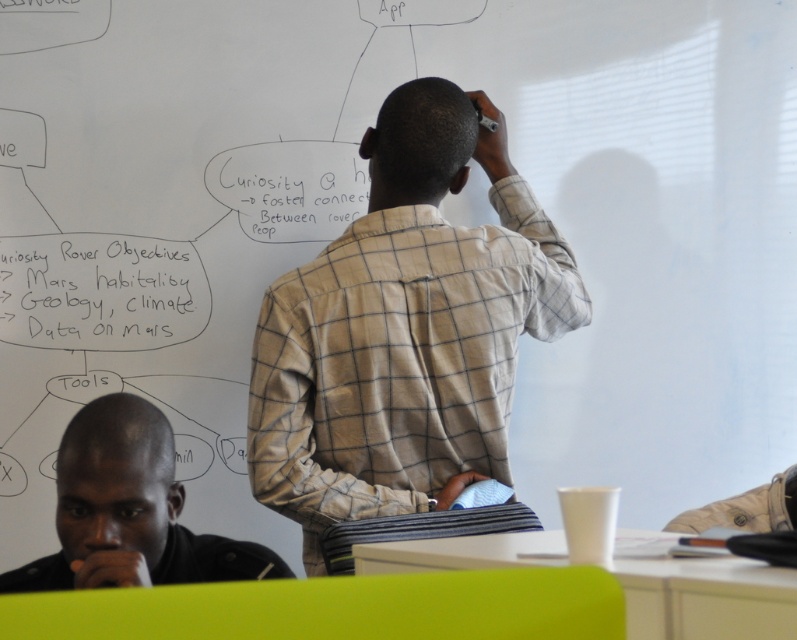
Is point (148, 513) less distant than point (57, 310)?

Yes.

Is black leather jacket at lower left bigger than white paperboard at upper center?

Indeed, black leather jacket at lower left has a larger size compared to white paperboard at upper center.

Which is in front, point (112, 547) or point (18, 285)?

Point (112, 547) is more forward.

Where is `black leather jacket at lower left`? Image resolution: width=797 pixels, height=640 pixels. black leather jacket at lower left is located at coordinates (128, 509).

This screenshot has width=797, height=640. Describe the element at coordinates (405, 328) in the screenshot. I see `light beige checkered shirt at center` at that location.

Does light beige checkered shirt at center appear on the right side of black leather jacket at lower left?

Indeed, light beige checkered shirt at center is positioned on the right side of black leather jacket at lower left.

Is point (487, 412) more distant than point (151, 419)?

Yes, point (487, 412) is farther from viewer.

Identify the location of light beige checkered shirt at center. The width and height of the screenshot is (797, 640). (405, 328).

Between light beige checkered shirt at center and white paperboard at upper center, which one is positioned higher?

white paperboard at upper center is above.

Which is below, light beige checkered shirt at center or white paperboard at upper center?

light beige checkered shirt at center is below.

Between point (265, 316) and point (50, 236), which one is positioned behind?

The point (50, 236) is behind.

The image size is (797, 640). What are the coordinates of `light beige checkered shirt at center` in the screenshot? It's located at (405, 328).